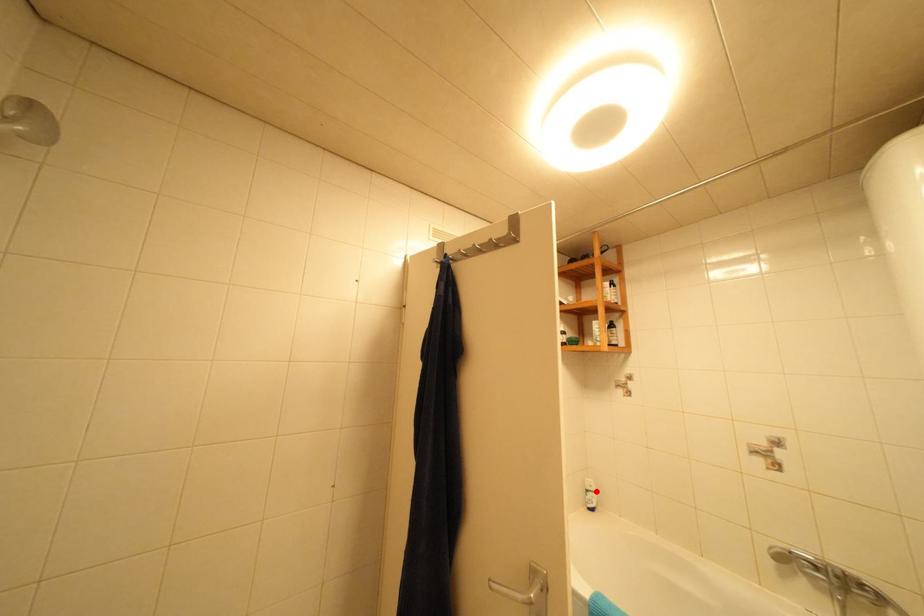
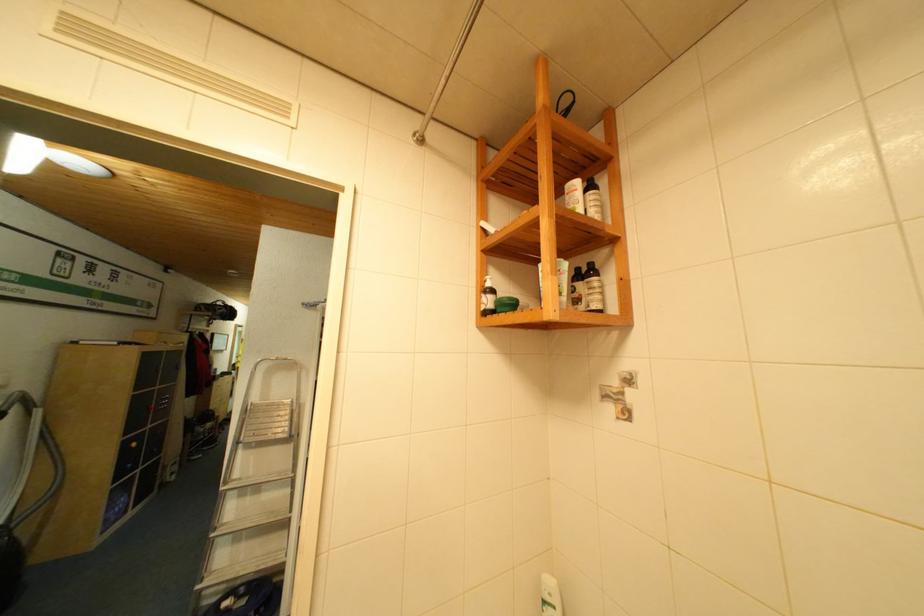
In the second image, find the point that corresponds to the highlighted location in the first image.

(553, 602)